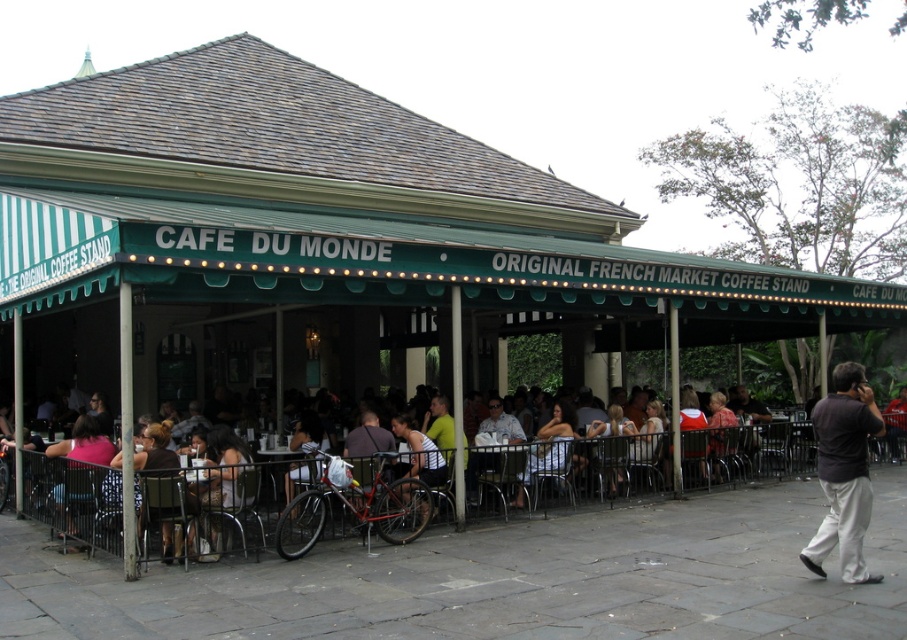
Who is positioned more to the left, gray fabric shirt at right or white textured tank top at center?

white textured tank top at center is more to the left.

What do you see at coordinates (844, 472) in the screenshot?
I see `gray fabric shirt at right` at bounding box center [844, 472].

Find the location of a particular element. Image resolution: width=907 pixels, height=640 pixels. gray fabric shirt at right is located at coordinates (844, 472).

Can you confirm if gray fabric shirt at right is shorter than white fabric dress at lower center?

Yes.

Is gray fabric shirt at right to the left of white fabric dress at lower center from the viewer's perspective?

No, gray fabric shirt at right is not to the left of white fabric dress at lower center.

Between point (830, 547) and point (246, 504), which one is positioned in front?

Point (830, 547) is more forward.

This screenshot has width=907, height=640. In order to click on gray fabric shirt at right in this screenshot , I will do `click(844, 472)`.

Between matte black shirt at center and pink fabric shirt at lower left, which one is positioned lower?

matte black shirt at center is below.

Between point (568, 420) and point (100, 451), which one is positioned behind?

Point (568, 420)

At what (x,y) coordinates should I click in order to perform the action: click on matte black shirt at center. Please return your answer as a coordinate pair (x, y). Looking at the image, I should click on (549, 445).